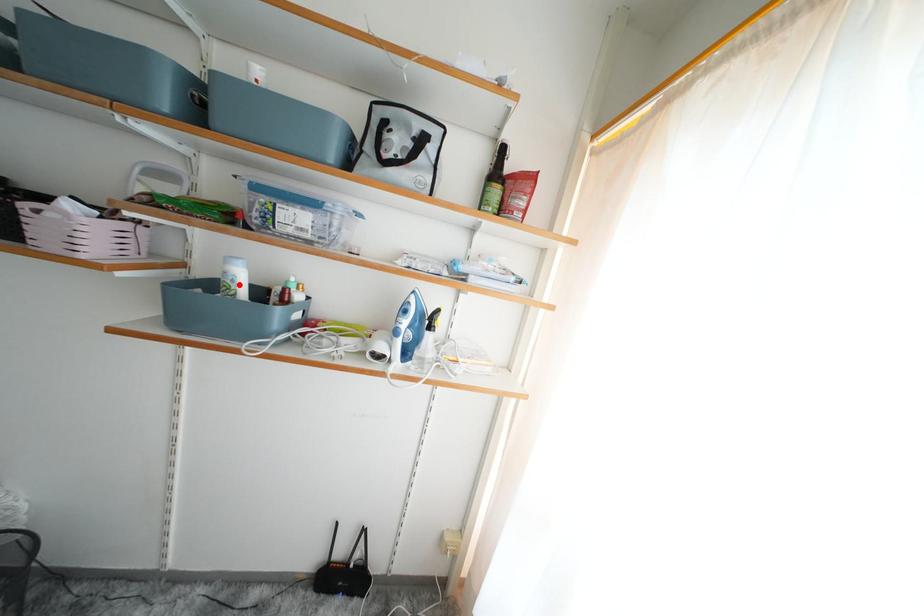
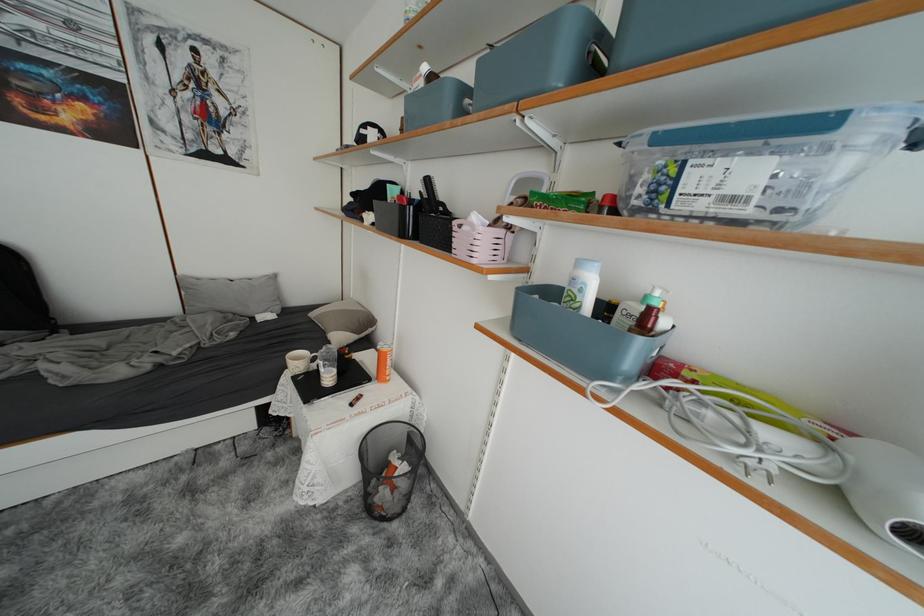
Where in the second image is the point corresponding to the highlighted location from the first image?

(588, 294)